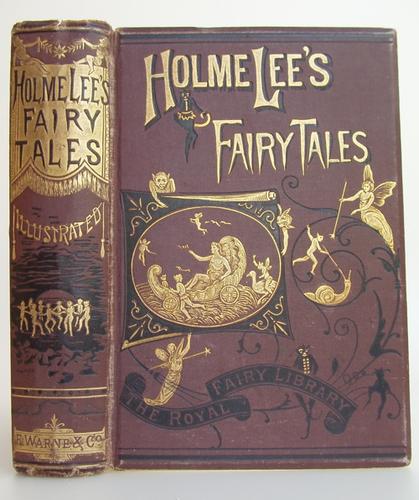
Locate an element on the screen. 1 book spine is located at coordinates (86, 272).